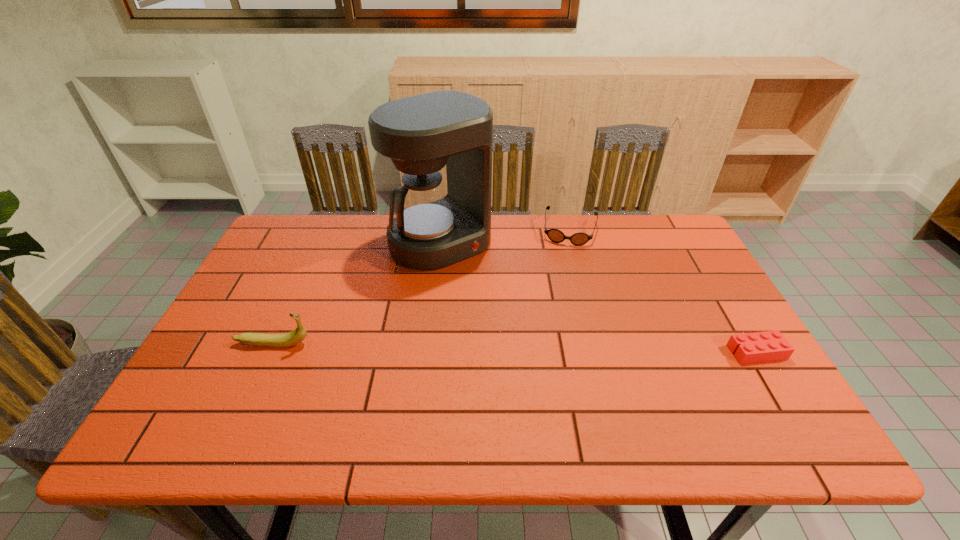
I want to click on free space between the leftmost object and the tallest object, so click(357, 293).

Locate an element on the screen. This screenshot has height=540, width=960. unoccupied position between the rightmost object and the tallest object is located at coordinates (599, 297).

Where is `vacant area that lies between the coffee maker and the rightmost object`? vacant area that lies between the coffee maker and the rightmost object is located at coordinates click(x=599, y=297).

This screenshot has height=540, width=960. What are the coordinates of `free space between the second tallest object and the Lego` in the screenshot? It's located at (515, 348).

Find the location of a particular element. vacant area that lies between the tallest object and the Lego is located at coordinates (599, 297).

Find the location of `the closest object to the Lego`. the closest object to the Lego is located at coordinates [x=555, y=235].

The image size is (960, 540). Find the location of `object that is the third closest to the banana`. object that is the third closest to the banana is located at coordinates coord(769,346).

Locate an element on the screen. Image resolution: width=960 pixels, height=540 pixels. vacant space that satisfies the following two spatial constraints: 1. on the front side of the rightmost object; 2. on the left side of the sunglasses is located at coordinates (602, 353).

Where is `free space that satisfies the following two spatial constraints: 1. on the front side of the rightmost object; 2. on the left side of the coffee maker`? The width and height of the screenshot is (960, 540). free space that satisfies the following two spatial constraints: 1. on the front side of the rightmost object; 2. on the left side of the coffee maker is located at coordinates (428, 353).